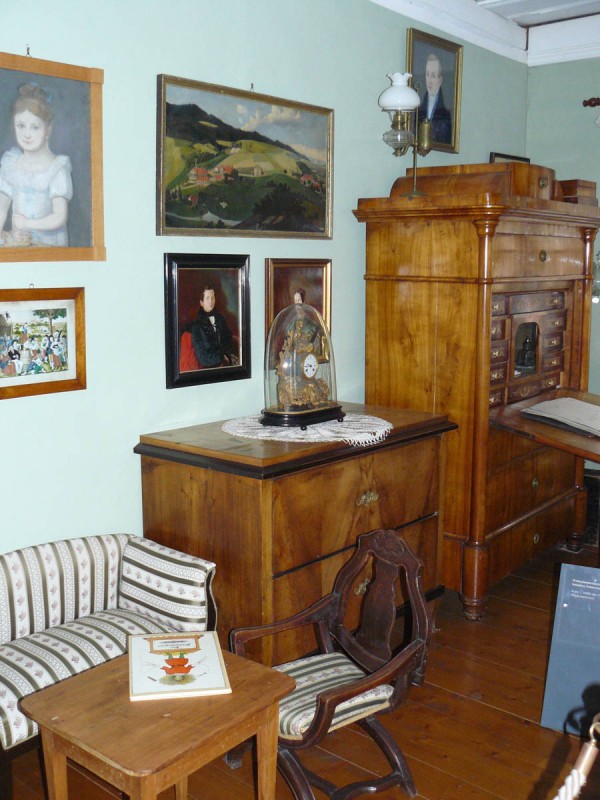
Find the location of a particular element. This screenshot has height=800, width=600. place to sit is located at coordinates (67, 658), (333, 682).